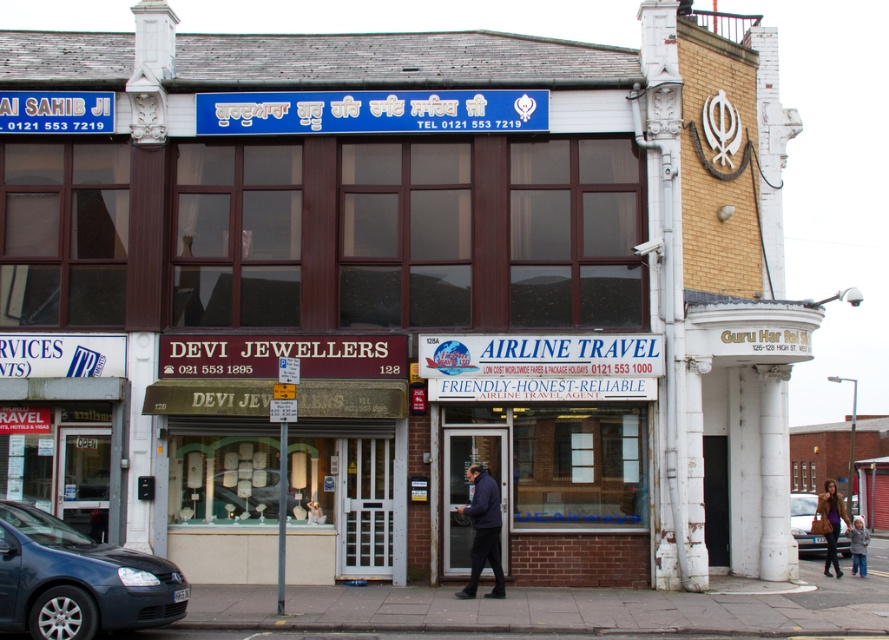
You are a pedestrian standing on the street looking at the dark blue jacket at center and the matte brown car at lower right. Which object is taller?

The dark blue jacket at center is not as tall as the matte brown car at lower right, so the matte brown car at lower right is taller.

You are a pedestrian standing on the street looking at the building. You see a metallic blue car at lower left and a dark blue jacket at center. Which object is taller?

The dark blue jacket at center is taller than the metallic blue car at lower left.